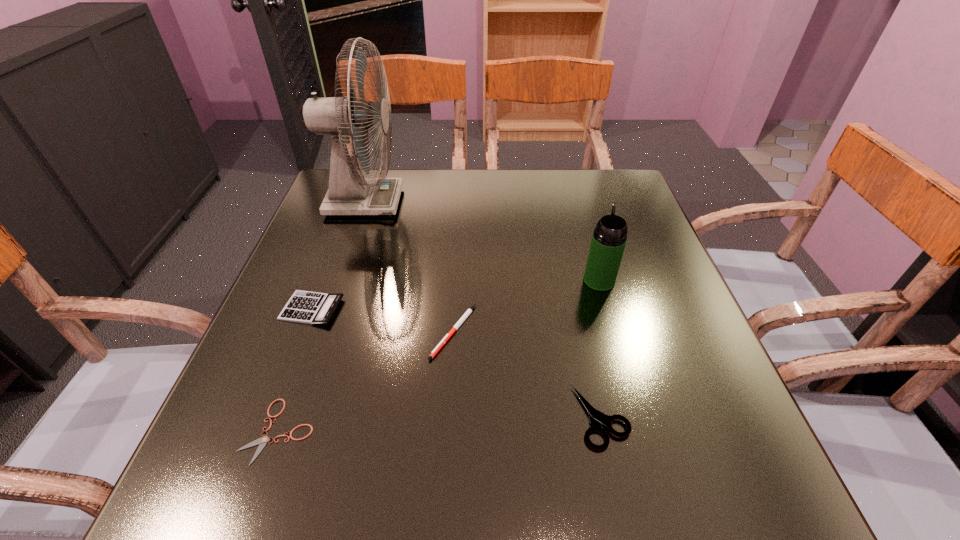
This screenshot has height=540, width=960. I want to click on free location that satisfies the following two spatial constraints: 1. on the front-facing side of the fan; 2. from the spout of the thermos bottle, so click(x=338, y=281).

Locate an element on the screen. Image resolution: width=960 pixels, height=540 pixels. free space that satisfies the following two spatial constraints: 1. on the front-facing side of the tallest object; 2. on the left side of the taller shears is located at coordinates (291, 417).

You are a GUI agent. You are given a task and a screenshot of the screen. Output one action in this format:
    pyautogui.click(x=<x>, y=<y>)
    Task: Click on the vacant point that satisfies the following two spatial constraints: 1. on the front side of the third tallest object; 2. on the right side of the right shears
    This screenshot has height=540, width=960.
    Given the screenshot: What is the action you would take?
    pyautogui.click(x=272, y=417)